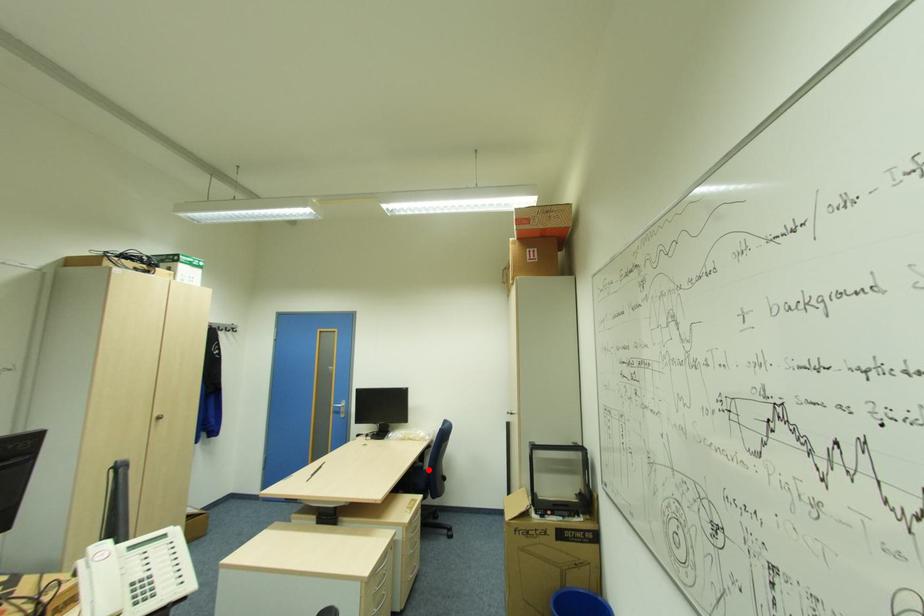
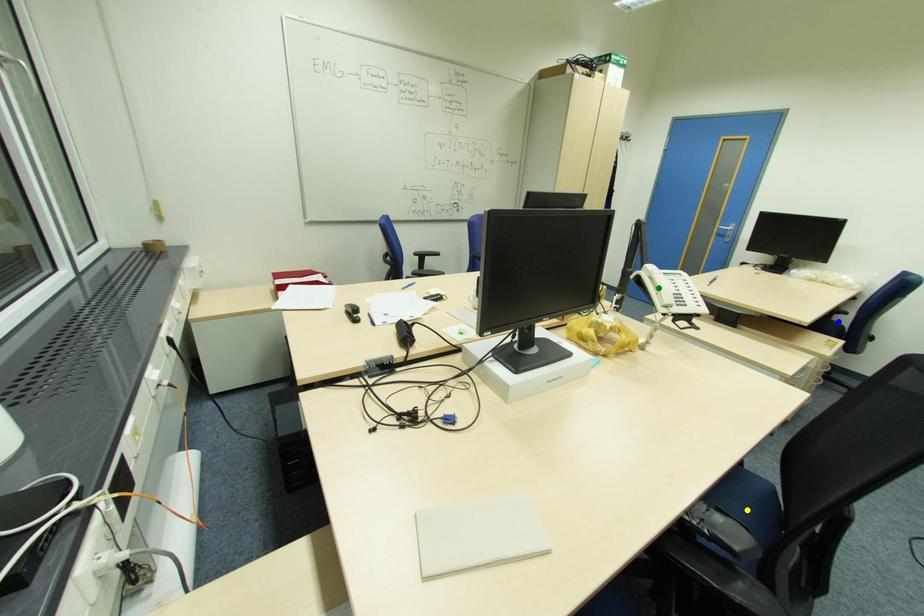
Question: I am providing you with two images of the same scene from different viewpoints. A red point is marked on the first image. You are given multiple points on the second image. In image 2, which mark is for the same physical point as the one in image 1?

Choices:
 (A) green point
 (B) blue point
 (C) yellow point

Answer: (B)